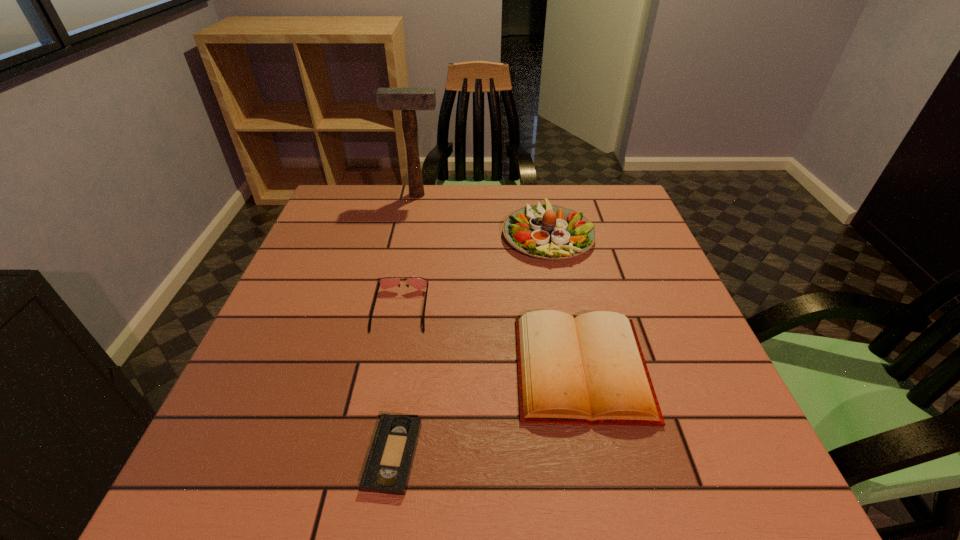
In the image, there is a desktop. Identify the location of vacant space at the left edge. (288, 368).

In the image, there is a desktop. At what (x,y) coordinates should I click in order to perform the action: click on vacant space at the right edge. Please return your answer as a coordinate pair (x, y). The width and height of the screenshot is (960, 540). Looking at the image, I should click on (671, 279).

Where is `free space at the far right corner`? free space at the far right corner is located at coordinates (602, 208).

The image size is (960, 540). What are the coordinates of `vacant space that's between the Bible and the tallest object` in the screenshot? It's located at (499, 281).

Where is `vacant space in between the second farthest object and the shortest object`? vacant space in between the second farthest object and the shortest object is located at coordinates (470, 345).

Find the location of `unoccupied position between the videotape and the Bible`. unoccupied position between the videotape and the Bible is located at coordinates (488, 411).

At what (x,y) coordinates should I click in order to perform the action: click on blank region between the salad plate and the sunglasses. Please return your answer as a coordinate pair (x, y). The height and width of the screenshot is (540, 960). Looking at the image, I should click on (474, 272).

At what (x,y) coordinates should I click in order to perform the action: click on vacant region between the Bible and the shortest object. Please return your answer as a coordinate pair (x, y). This screenshot has width=960, height=540. Looking at the image, I should click on (488, 411).

The image size is (960, 540). Find the location of `free spot between the shortest object and the Bible`. free spot between the shortest object and the Bible is located at coordinates (488, 411).

This screenshot has width=960, height=540. Identify the location of free space between the shortest object and the second farthest object. (470, 345).